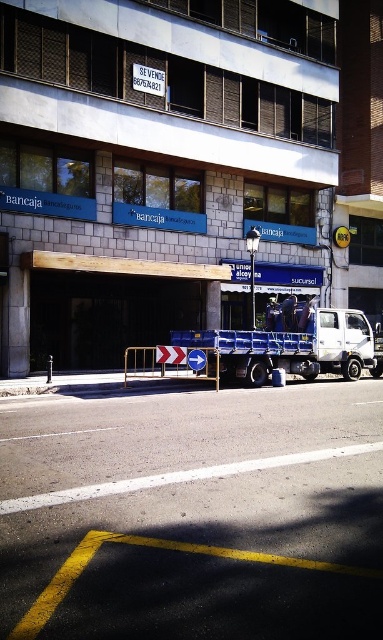
You are a pedestrian standing on the sidewalk in front of the building. You see the white matte truck at center and the metallic silver barricade at center. Which object is closer to you?

The metallic silver barricade at center is closer to you because the white matte truck at center is located above it.

You are a pedestrian trying to cross the street in front of the building. There is a white matte truck at center and a metallic silver barricade at center. Which object is closer to the sidewalk on the left side of the street?

The metallic silver barricade at center is closer to the sidewalk on the left side of the street because the white matte truck at center is to the right of it.